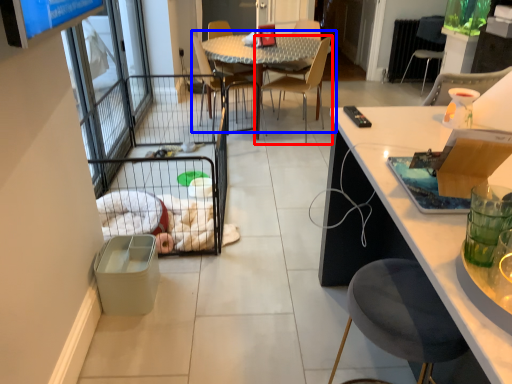
Question: Which object is closer to the camera taking this photo, chair (highlighted by a red box) or kitchen & dining room table (highlighted by a blue box)?

Choices:
 (A) chair
 (B) kitchen & dining room table

Answer: (A)